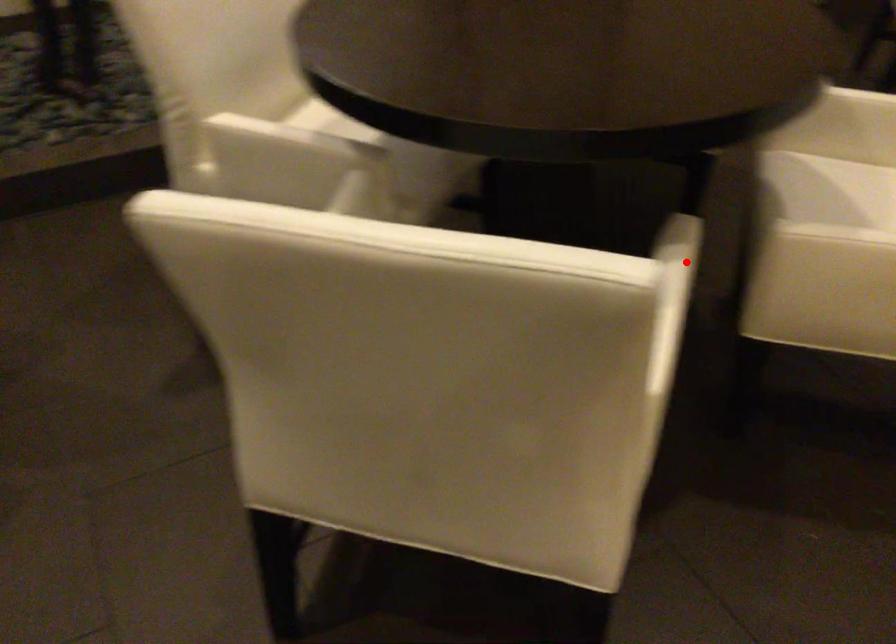
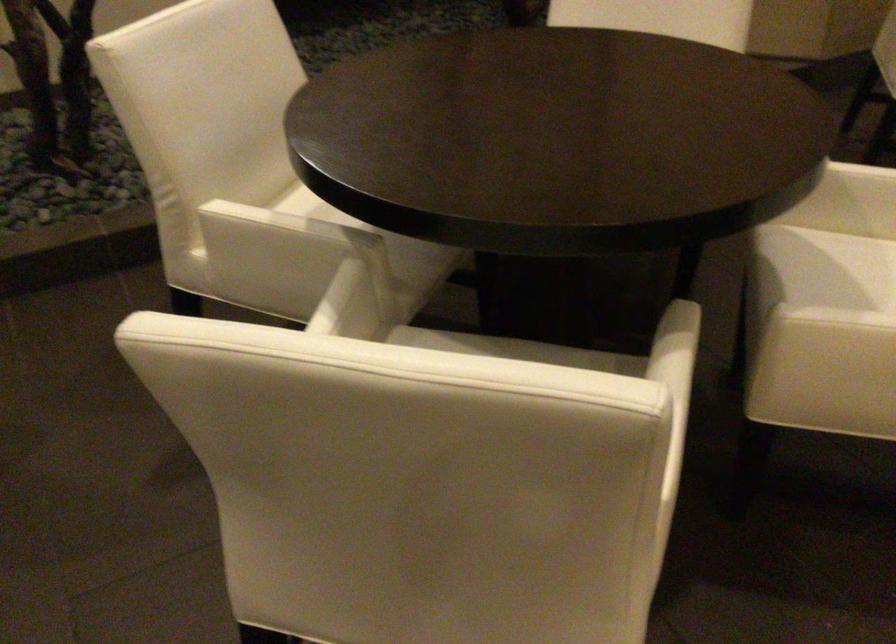
Where in the second image is the point corresponding to the highlighted location from the first image?

(688, 353)